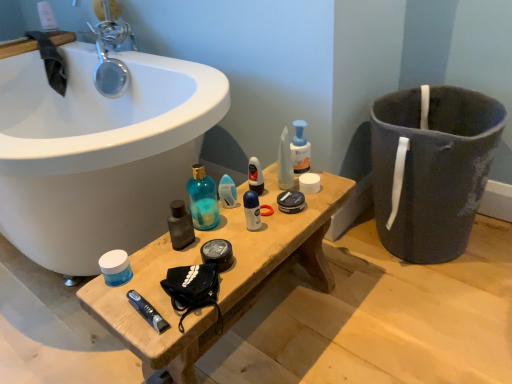
You are a GUI agent. You are given a task and a screenshot of the screen. Output one action in this format:
    pyautogui.click(x=<x>, y=<y>)
    Task: Click on the empty space that is to the right of blue matte toothpaste at center
    Image resolution: width=512 pixels, height=384 pixels.
    Given the screenshot: What is the action you would take?
    pyautogui.click(x=209, y=287)